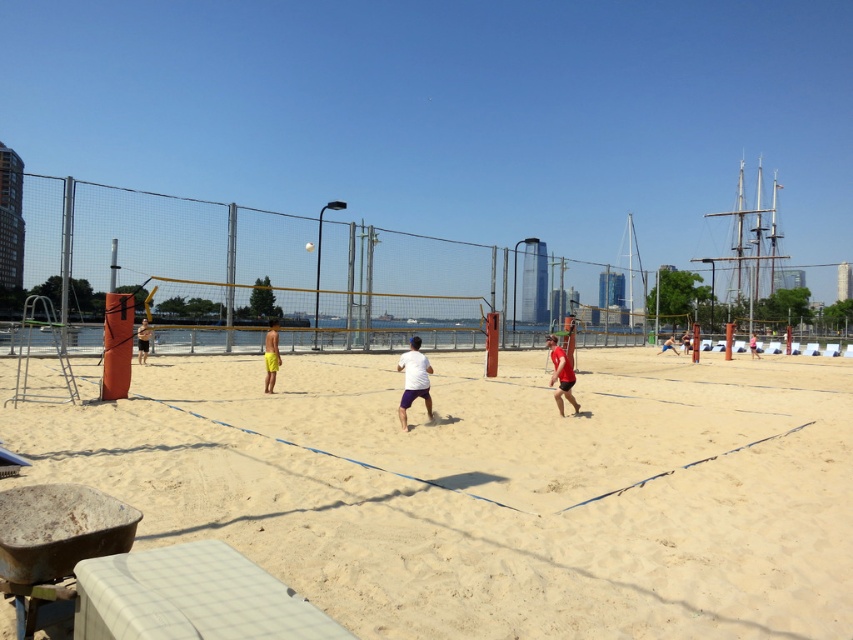
Question: Is white fabric shirt at center behind matte white shirt at center?

Choices:
 (A) yes
 (B) no

Answer: (B)

Question: Which object is the farthest from the white matte volleyball at center?

Choices:
 (A) white sand at center
 (B) red matte shorts at center

Answer: (A)

Question: Is red matte shorts at center to the right of white fabric shirt at center from the viewer's perspective?

Choices:
 (A) no
 (B) yes

Answer: (A)

Question: Where is tan fabric towel at left located in relation to white fabric volleyball net at center in the image?

Choices:
 (A) left
 (B) right

Answer: (A)

Question: Which point is farther from the camera taking this photo?

Choices:
 (A) (401, 417)
 (B) (312, 248)
 (C) (752, 355)

Answer: (C)

Question: Considering the real-world distances, which object is closest to the matte white shirt at center?

Choices:
 (A) red matte shorts at center
 (B) white sand at center
 (C) white matte shirt at center
 (D) white matte volleyball at center

Answer: (D)